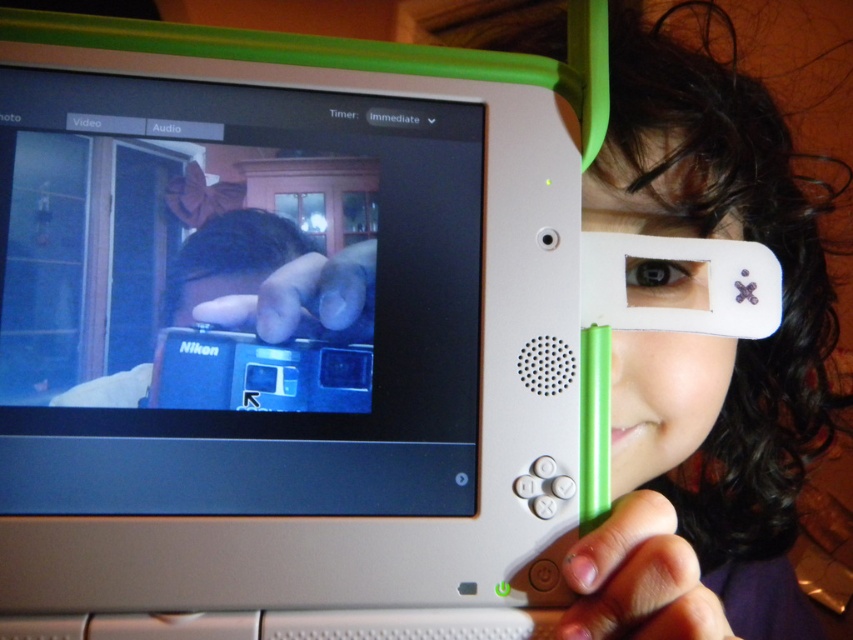
From the picture: You are a photographer who needs to choose between two cameras for a quick photo shoot. You see a metallic blue camera at center and a blue plastic camera at center. Which one should you pick if you want the bigger one?

The metallic blue camera at center is larger in size compared to the blue plastic camera at center, so you should pick the metallic blue camera at center for the bigger option.

You are holding a device with a green border and white body. You notice a point on the screen at coordinates point (648, 333). If your eyes are 16.47 inches away from this point, can you reach it with your fingertip?

The point (648, 333) is 16.47 inches away from the viewer. Since the average fingertip can reach up to about 16 inches, you might need to stretch slightly to touch it.

You are a photographer trying to determine the best composition for your shot. You have a metallic blue camera at center and a matte white eye at upper right in your frame. Which object should you consider adjusting if you want to ensure both fit within the frame?

The metallic blue camera at center might be wider than the matte white eye at upper right, so you should adjust the composition to accommodate the wider metallic blue camera at center to ensure both fit.